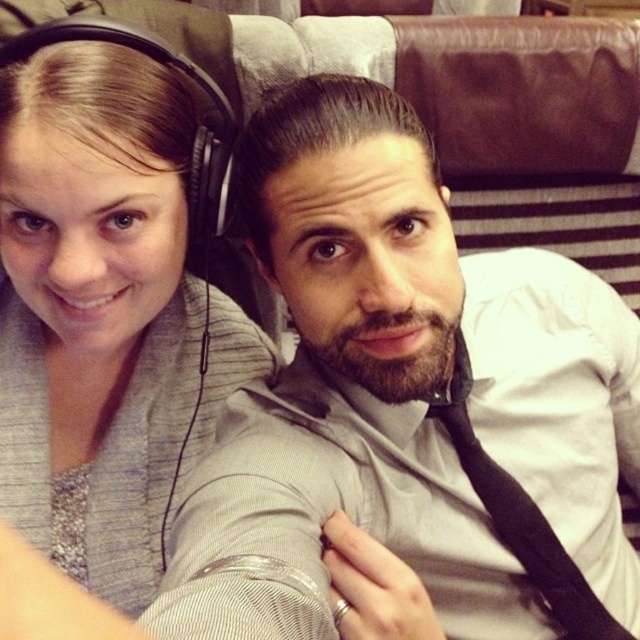
Between matte white shirt at center and gray fabric at upper left, which one is positioned lower?

matte white shirt at center is lower down.

From the picture: Can you confirm if matte white shirt at center is positioned to the right of gray fabric at upper left?

Yes, matte white shirt at center is to the right of gray fabric at upper left.

Who is more forward, [292,157] or [64,102]?

Point [292,157] is in front.

Where is `matte white shirt at center`? The width and height of the screenshot is (640, 640). matte white shirt at center is located at coordinates (403, 396).